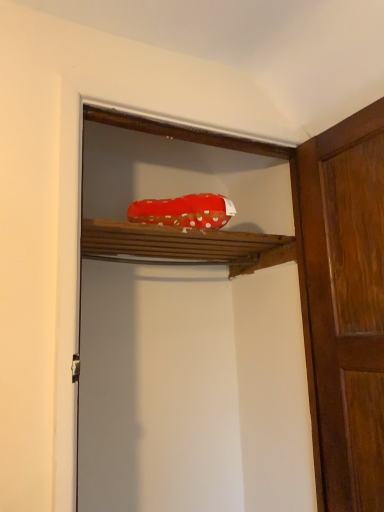
Question: Based on their sizes in the image, would you say red fabric shoe at upper center is bigger or smaller than wooden door at right?

Choices:
 (A) big
 (B) small

Answer: (A)

Question: Considering the positions of red fabric shoe at upper center and wooden door at right in the image, is red fabric shoe at upper center taller or shorter than wooden door at right?

Choices:
 (A) short
 (B) tall

Answer: (B)

Question: Estimate the real-world distances between objects in this image. Which object is closer to the red polka dot fabric at upper center?

Choices:
 (A) wooden door at right
 (B) red fabric shoe at upper center

Answer: (A)

Question: Which object is the closest to the red fabric shoe at upper center?

Choices:
 (A) wooden door at right
 (B) red polka dot fabric at upper center

Answer: (A)